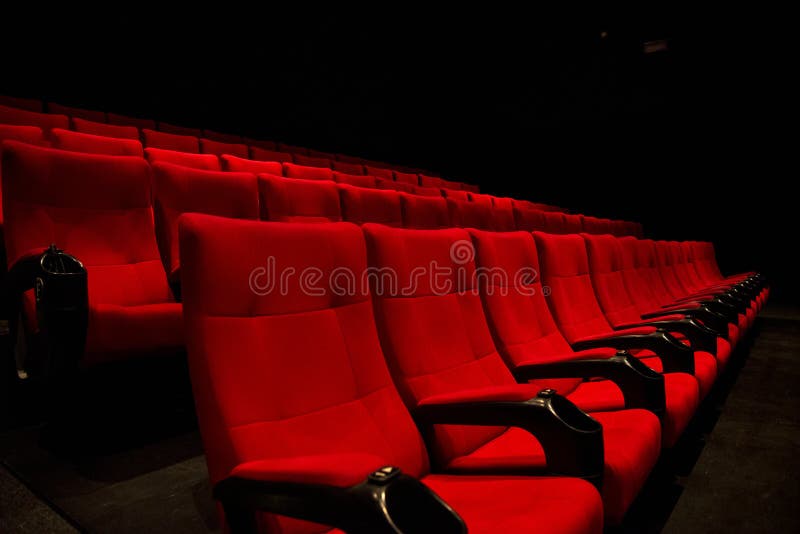
The image size is (800, 534). I want to click on cupholder, so click(422, 512), click(561, 421), click(62, 270), click(642, 369), click(560, 412), click(673, 347), click(701, 326), click(712, 318).